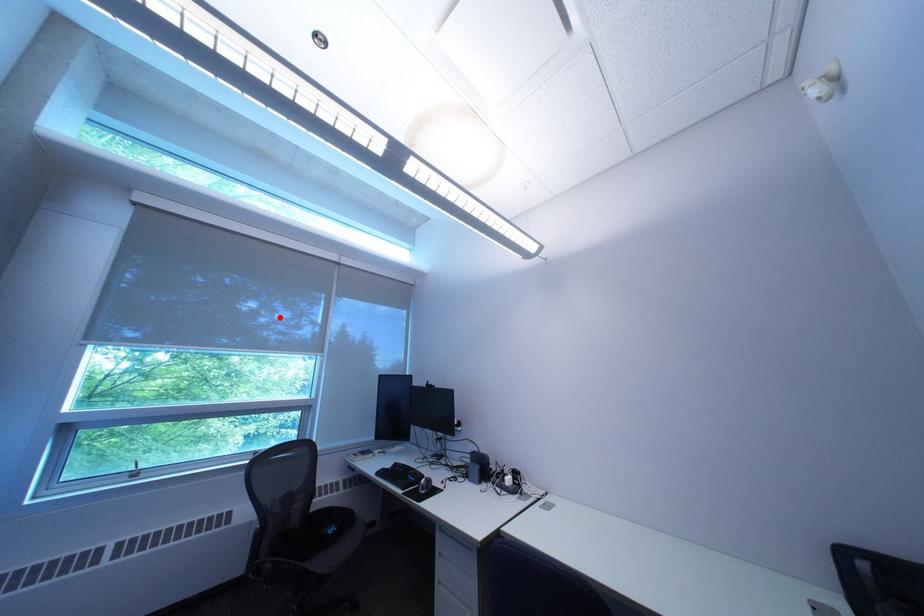
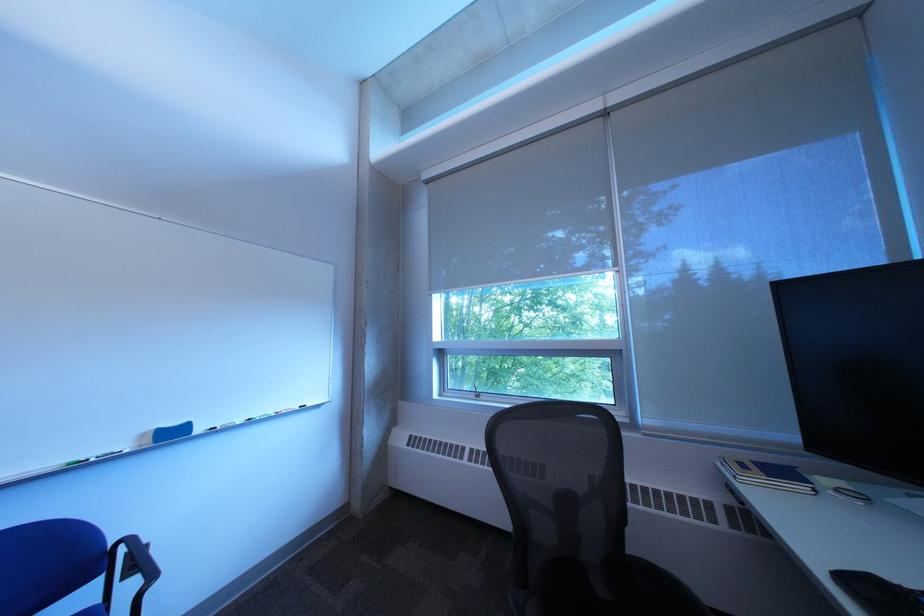
The point at the highlighted location is marked in the first image. Where is the corresponding point in the second image?

(611, 267)